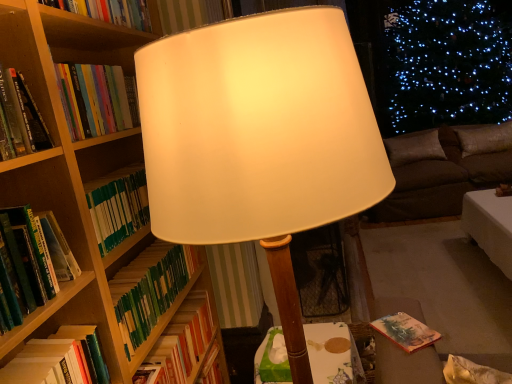
Question: Is brown suede pillow at right, placed as the first pillow when sorted from left to right, positioned with its back to green matte book at left, the fourth book when ordered from top to bottom?

Choices:
 (A) yes
 (B) no

Answer: (B)

Question: Can you confirm if brown suede pillow at right, placed as the first pillow when sorted from left to right, is smaller than green matte book at left, which ranks as the 1th book in bottom-to-top order?

Choices:
 (A) no
 (B) yes

Answer: (A)

Question: Is brown suede pillow at right, arranged as the 2th pillow when viewed from the right, not inside green matte book at left, the fourth book when ordered from top to bottom?

Choices:
 (A) yes
 (B) no

Answer: (A)

Question: Is brown suede pillow at right, placed as the first pillow when sorted from left to right, to the right of green matte book at left, the fourth book when ordered from top to bottom, from the viewer's perspective?

Choices:
 (A) no
 (B) yes

Answer: (B)

Question: Is brown suede pillow at right, placed as the first pillow when sorted from left to right, in contact with green matte book at left, the fourth book when ordered from top to bottom?

Choices:
 (A) no
 (B) yes

Answer: (A)

Question: Is point (225, 183) positioned closer to the camera than point (345, 337)?

Choices:
 (A) farther
 (B) closer

Answer: (B)

Question: From the image's perspective, is matte white lampshade at center above or below wooden table at center?

Choices:
 (A) above
 (B) below

Answer: (A)

Question: Is matte white lampshade at center situated inside wooden table at center or outside?

Choices:
 (A) inside
 (B) outside

Answer: (B)

Question: In terms of size, does matte white lampshade at center appear bigger or smaller than wooden table at center?

Choices:
 (A) small
 (B) big

Answer: (B)

Question: Does point (411, 157) appear closer or farther from the camera than point (112, 13)?

Choices:
 (A) farther
 (B) closer

Answer: (A)

Question: From the image's perspective, is brown suede pillow at right, placed as the first pillow when sorted from left to right, above or below hardcover book at upper left, the 4th book in the bottom-to-top sequence?

Choices:
 (A) below
 (B) above

Answer: (A)

Question: Considering their positions, is brown suede pillow at right, placed as the first pillow when sorted from left to right, located in front of or behind hardcover book at upper left, the 4th book in the bottom-to-top sequence?

Choices:
 (A) front
 (B) behind

Answer: (B)

Question: Considering the positions of brown suede pillow at right, placed as the first pillow when sorted from left to right, and hardcover book at upper left, which is the first book in top-to-bottom order, in the image, is brown suede pillow at right, placed as the first pillow when sorted from left to right, taller or shorter than hardcover book at upper left, which is the first book in top-to-bottom order,?

Choices:
 (A) short
 (B) tall

Answer: (B)

Question: Based on their sizes in the image, would you say green hardcover book at left, which is the 3th book in bottom-to-top order, is bigger or smaller than brown fabric pillow at right, the first pillow positioned from the right?

Choices:
 (A) big
 (B) small

Answer: (B)

Question: Is green hardcover book at left, which is the 2th book from top to bottom, to the left or to the right of brown fabric pillow at right, marked as the 2th pillow in a left-to-right arrangement, in the image?

Choices:
 (A) left
 (B) right

Answer: (A)